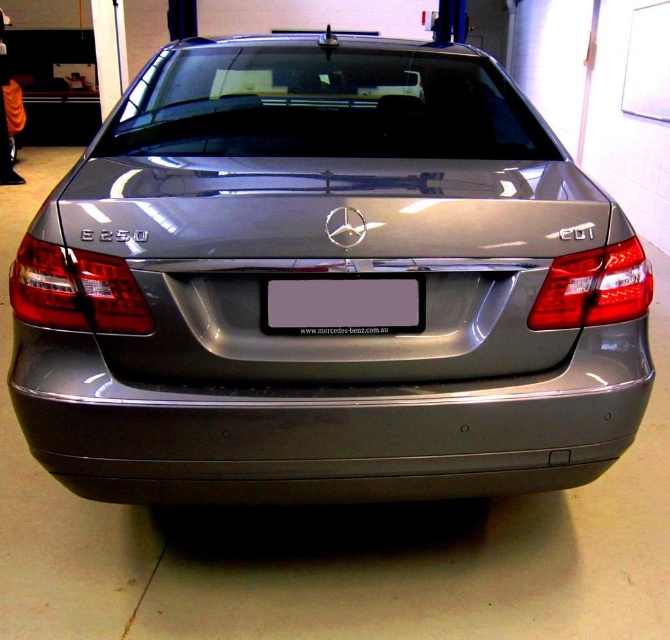
Is satin metallic car at center positioned behind gray matte license plate at center?

No, it is not.

Is point (429, 96) farther from viewer compared to point (381, 310)?

Yes, point (429, 96) is behind point (381, 310).

Which is in front, point (505, 289) or point (354, 330)?

Point (354, 330)

Image resolution: width=670 pixels, height=640 pixels. Identify the location of satin metallic car at center. (326, 276).

Between satin metallic bumper at center and gray matte license plate at center, which one is positioned higher?

gray matte license plate at center

Is satin metallic bumper at center in front of gray matte license plate at center?

No, it is not.

Is point (204, 467) positioned behind point (289, 292)?

Yes, it is.

Identify the location of satin metallic bumper at center. The image size is (670, 640). click(326, 428).

Does satin metallic car at center have a smaller size compared to satin metallic bumper at center?

No, satin metallic car at center is not smaller than satin metallic bumper at center.

The image size is (670, 640). Describe the element at coordinates (326, 276) in the screenshot. I see `satin metallic car at center` at that location.

Is point (54, 246) farther from viewer compared to point (401, 492)?

No, (54, 246) is in front of (401, 492).

You are a GUI agent. You are given a task and a screenshot of the screen. Output one action in this format:
    pyautogui.click(x=<x>, y=<y>)
    Task: Click on the satin metallic car at center
    The image size is (670, 640).
    Given the screenshot: What is the action you would take?
    pyautogui.click(x=326, y=276)